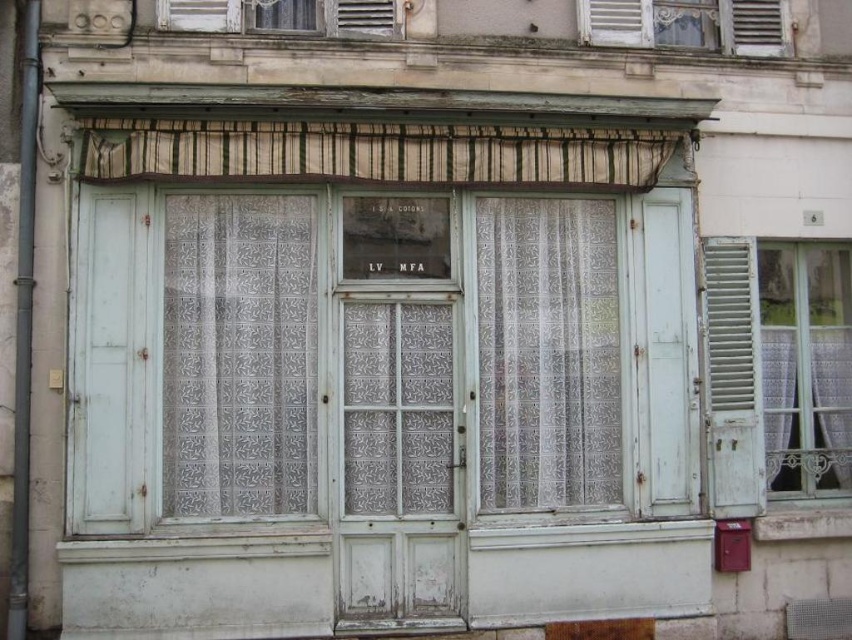
Which of these two, white lace curtain at left or white lace curtain at center, stands taller?

white lace curtain at center is taller.

Does white lace curtain at left have a larger size compared to white lace curtain at center?

No, white lace curtain at left is not bigger than white lace curtain at center.

Does point (263, 285) come farther from viewer compared to point (556, 353)?

No.

You are a GUI agent. You are given a task and a screenshot of the screen. Output one action in this format:
    pyautogui.click(x=<x>, y=<y>)
    Task: Click on the white lace curtain at left
    
    Given the screenshot: What is the action you would take?
    pyautogui.click(x=239, y=355)

Can you confirm if white lace curtain at left is positioned to the right of striped fabric curtain at upper center?

No, white lace curtain at left is not to the right of striped fabric curtain at upper center.

Identify the location of white lace curtain at left. (239, 355).

Between point (252, 483) and point (478, 144), which one is positioned in front?

Point (252, 483) is more forward.

I want to click on white lace curtain at left, so click(x=239, y=355).

Is white lace curtain at left to the right of white painted wood at upper right from the viewer's perspective?

Incorrect, white lace curtain at left is not on the right side of white painted wood at upper right.

Does white lace curtain at left have a lesser height compared to white painted wood at upper right?

Incorrect, white lace curtain at left's height does not fall short of white painted wood at upper right's.

This screenshot has width=852, height=640. Find the location of `white lace curtain at left`. white lace curtain at left is located at coordinates (239, 355).